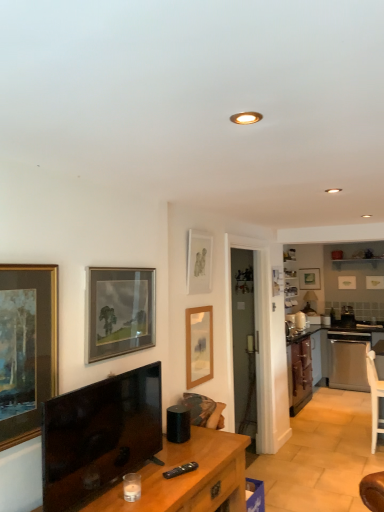
Question: Does white glossy shelf at upper right have a greater height compared to matte wooden picture frame at upper right, which ranks as the 3th picture frame in right-to-left order?

Choices:
 (A) no
 (B) yes

Answer: (A)

Question: Could matte wooden picture frame at upper right, positioned as the first picture frame in back-to-front order, be considered to be inside white glossy shelf at upper right?

Choices:
 (A) yes
 (B) no

Answer: (B)

Question: From the image's perspective, is white glossy shelf at upper right over matte wooden picture frame at upper right, which ranks as the 3th picture frame in right-to-left order?

Choices:
 (A) no
 (B) yes

Answer: (B)

Question: Is white glossy shelf at upper right at the left side of matte wooden picture frame at upper right, the fifth picture frame in the left-to-right sequence?

Choices:
 (A) yes
 (B) no

Answer: (B)

Question: Can you confirm if white glossy shelf at upper right is smaller than matte wooden picture frame at upper right, positioned as the first picture frame in back-to-front order?

Choices:
 (A) yes
 (B) no

Answer: (B)

Question: Would you say white glossy shelf at upper right is a long distance from matte wooden picture frame at upper right, positioned as the first picture frame in back-to-front order?

Choices:
 (A) no
 (B) yes

Answer: (A)

Question: From a real-world perspective, is white wooden chair at lower right positioned over wooden picture frame at center, which is the 3th picture frame from front to back, based on gravity?

Choices:
 (A) no
 (B) yes

Answer: (A)

Question: Is white wooden chair at lower right thinner than wooden picture frame at center, marked as the third picture frame in a left-to-right arrangement?

Choices:
 (A) yes
 (B) no

Answer: (B)

Question: Is white wooden chair at lower right behind wooden picture frame at center, which appears as the fifth picture frame when viewed from the back?

Choices:
 (A) no
 (B) yes

Answer: (B)

Question: Is the position of white wooden chair at lower right less distant than that of wooden picture frame at center, the fifth picture frame in the right-to-left sequence?

Choices:
 (A) yes
 (B) no

Answer: (B)

Question: Considering the relative sizes of white wooden chair at lower right and wooden picture frame at center, marked as the third picture frame in a left-to-right arrangement, in the image provided, is white wooden chair at lower right wider than wooden picture frame at center, marked as the third picture frame in a left-to-right arrangement,?

Choices:
 (A) yes
 (B) no

Answer: (A)

Question: From a real-world perspective, is white wooden chair at lower right positioned under wooden picture frame at center, the fifth picture frame in the right-to-left sequence, based on gravity?

Choices:
 (A) no
 (B) yes

Answer: (B)

Question: Is matte gold picture frame at upper right, acting as the fifth picture frame starting from the front, at the back of wooden desk at center?

Choices:
 (A) no
 (B) yes

Answer: (A)